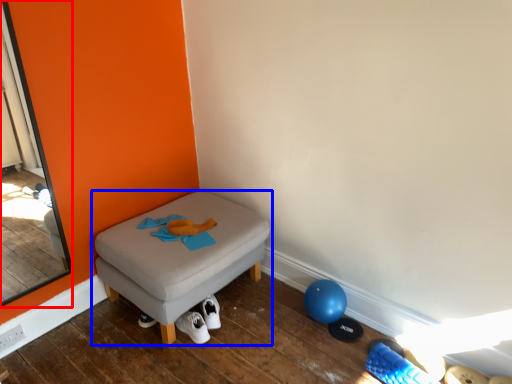
Question: Which of the following is the closest to the observer, screen door (highlighted by a red box) or furniture (highlighted by a blue box)?

Choices:
 (A) screen door
 (B) furniture

Answer: (A)